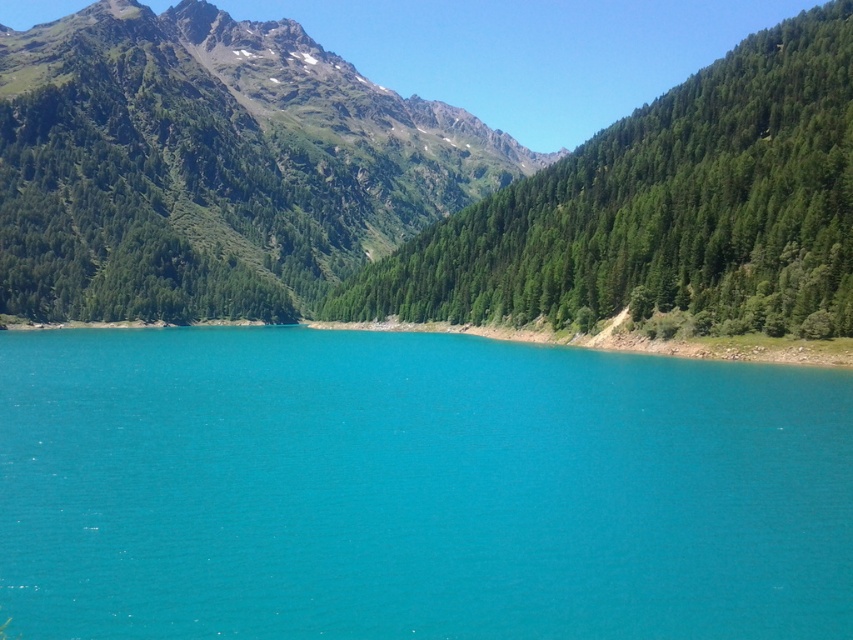
Question: Can you confirm if turquoise water at center is bigger than green textured tree at right?

Choices:
 (A) no
 (B) yes

Answer: (A)

Question: Is green textured mountain at upper left above green textured tree at right?

Choices:
 (A) no
 (B) yes

Answer: (B)

Question: Considering the real-world distances, which object is closest to the turquoise water at center?

Choices:
 (A) green textured mountain at upper left
 (B) green textured tree at right

Answer: (B)

Question: Where is green textured mountain at upper left located in relation to green textured tree at right in the image?

Choices:
 (A) right
 (B) left

Answer: (B)

Question: Which point is farther to the camera?

Choices:
 (A) green textured mountain at upper left
 (B) turquoise water at center
 (C) green textured tree at right

Answer: (A)

Question: Considering the real-world distances, which object is farthest from the green textured mountain at upper left?

Choices:
 (A) turquoise water at center
 (B) green textured tree at right

Answer: (A)